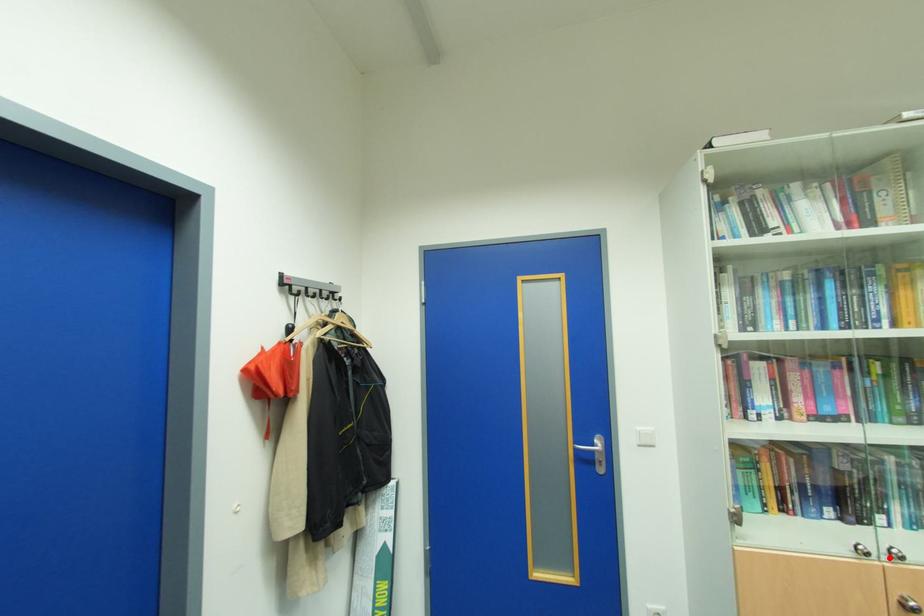
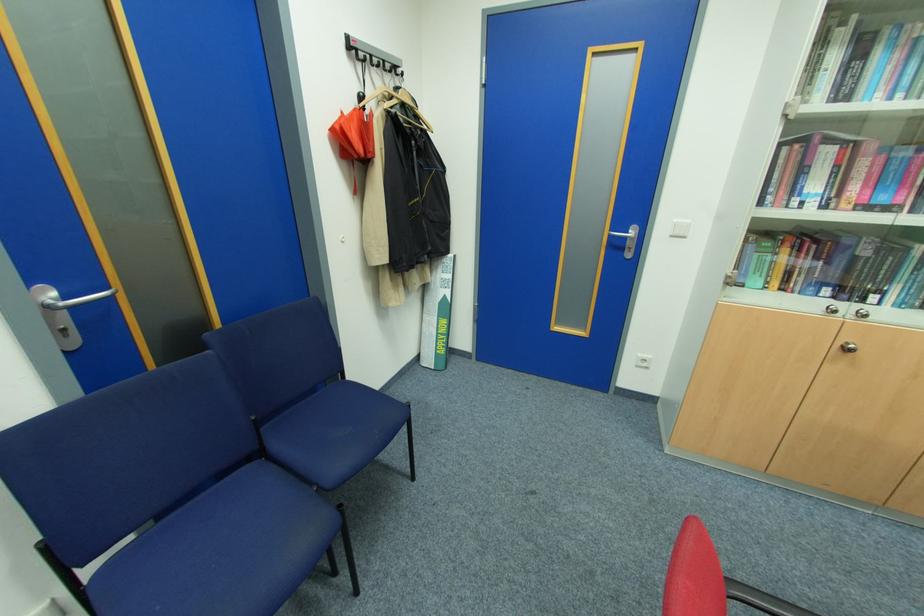
Where in the second image is the point corresponding to the highlighted location from the first image?

(855, 315)